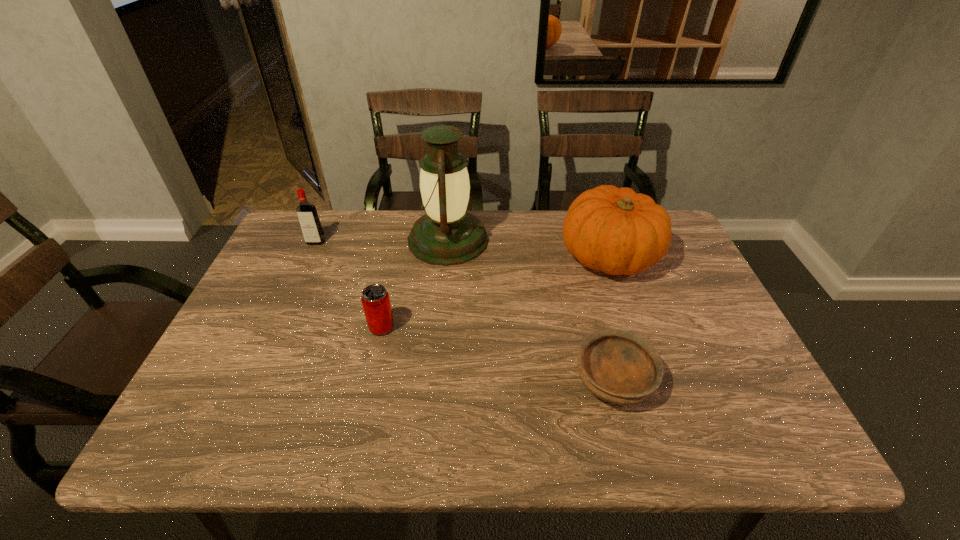
Identify the location of lantern. (447, 234).

Identify the location of pumpkin. The image size is (960, 540). (614, 230).

I want to click on the leftmost object, so click(x=309, y=221).

Image resolution: width=960 pixels, height=540 pixels. Find the location of `the second nearest object`. the second nearest object is located at coordinates (375, 299).

Identify the location of soda can. This screenshot has height=540, width=960. (375, 299).

I want to click on the nearest object, so click(x=619, y=367).

Locate an element on the screen. Image resolution: width=960 pixels, height=540 pixels. bowl is located at coordinates (619, 367).

Locate an element on the screen. vacant point located with the light compartment facing forward on the tallest object is located at coordinates (606, 240).

This screenshot has width=960, height=540. Identify the location of free space located on the front of the pumpkin. (655, 390).

Where is `vacant area located on the front and back of the vodka`? This screenshot has height=540, width=960. vacant area located on the front and back of the vodka is located at coordinates (287, 305).